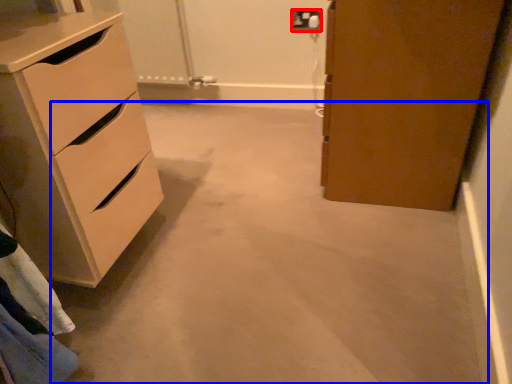
Question: Which point is further to the camera, electric outlet (highlighted by a red box) or concrete (highlighted by a blue box)?

Choices:
 (A) electric outlet
 (B) concrete

Answer: (A)